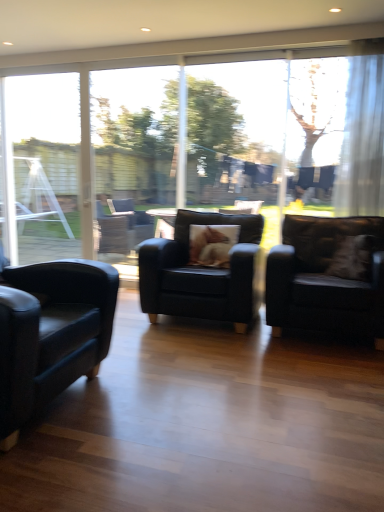
Where is `vacant area to the right of matte black armchair at left, placed as the first chair when sorted from left to right`? The height and width of the screenshot is (512, 384). vacant area to the right of matte black armchair at left, placed as the first chair when sorted from left to right is located at coordinates (170, 405).